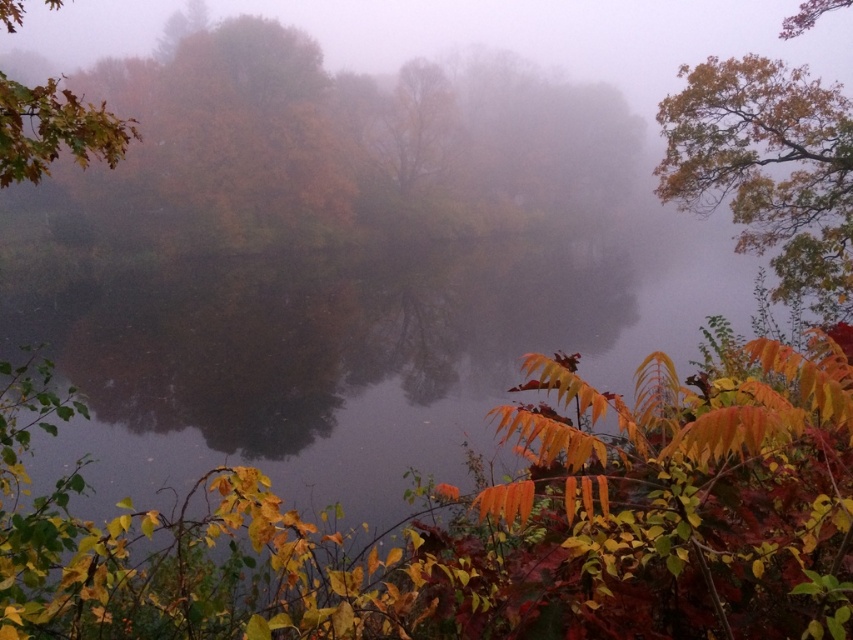
Question: Which of the following is the farthest from the observer?

Choices:
 (A) shiny brown leaves at upper left
 (B) yellow-green foliage at upper right

Answer: (B)

Question: Which is farther from the yellow-green foliage at upper right?

Choices:
 (A) autumn leaves at left
 (B) shiny brown leaves at upper left

Answer: (A)

Question: Can you confirm if yellow-green foliage at upper right is positioned to the left of shiny brown leaves at upper left?

Choices:
 (A) yes
 (B) no

Answer: (B)

Question: Can you confirm if autumn leaves at left is positioned below shiny brown leaves at upper left?

Choices:
 (A) no
 (B) yes

Answer: (A)

Question: Which point appears closest to the camera in this image?

Choices:
 (A) (10, 170)
 (B) (467, 189)
 (C) (782, 106)

Answer: (A)

Question: Where is autumn leaves at left located in relation to yellow-green foliage at upper right in the image?

Choices:
 (A) right
 (B) left

Answer: (B)